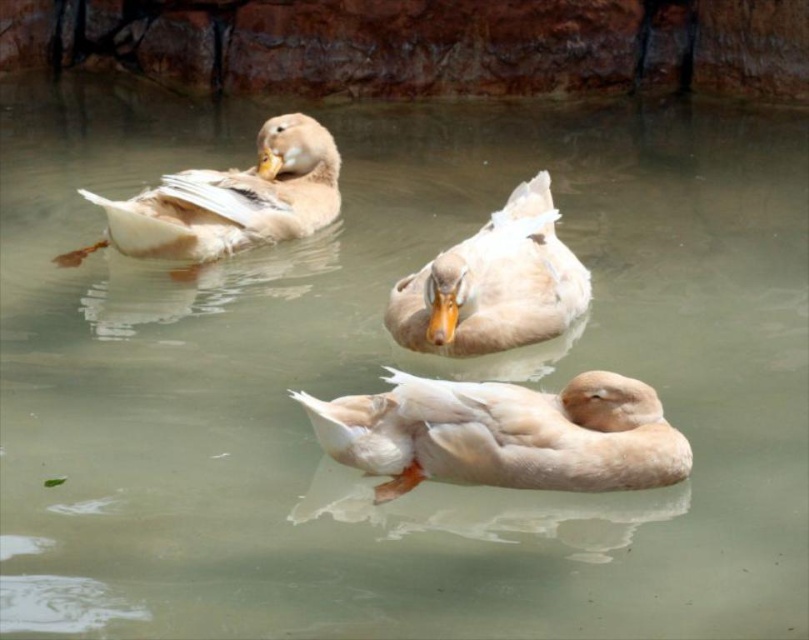
You are standing at the edge of the pond and see two points on the water surface, one at point (x=437, y=477) and the other at point (x=405, y=300). Which point is closer to your position?

Point (x=437, y=477) is closer to the camera than point (x=405, y=300), so the point at (x=437, y=477) is closer to your position.